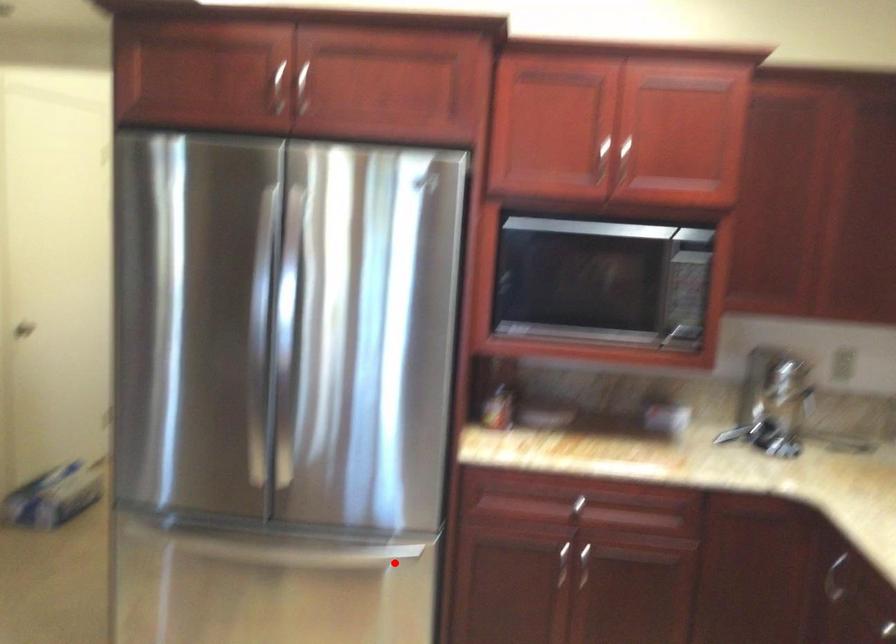
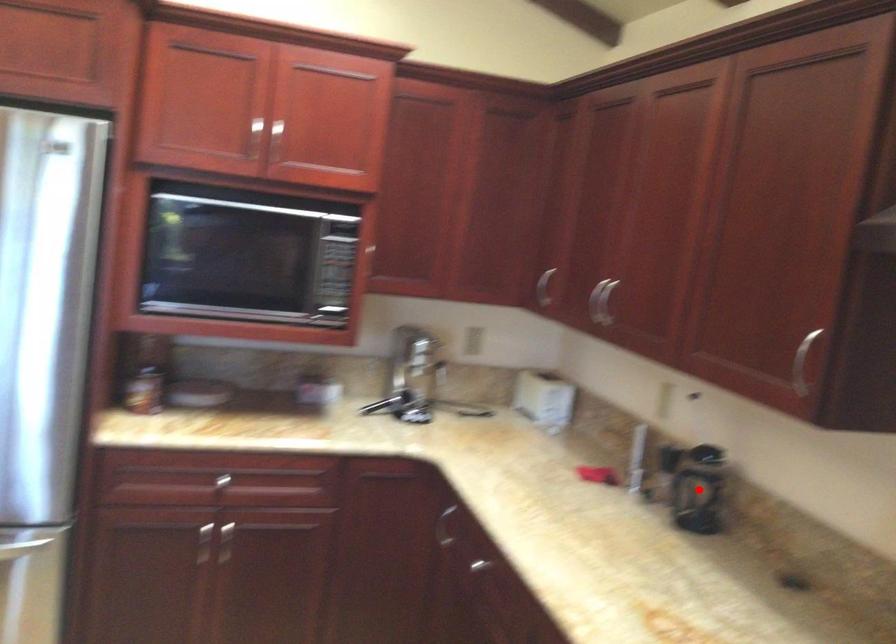
I am providing you with two images of the same scene from different viewpoints. A red point is marked on the first image and another point is marked on the second image. Are the points marked in image1 and image2 representing the same 3D position?

No